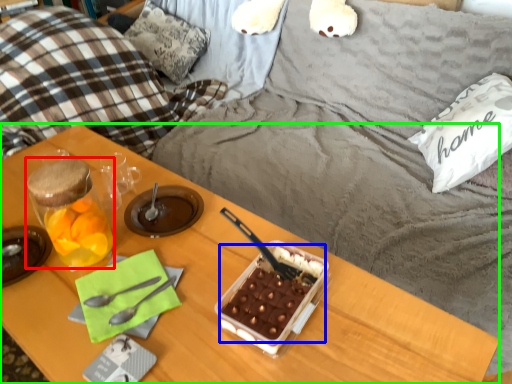
Question: Which object is positioned farthest from snack (highlighted by a red box)? Select from snack (highlighted by a blue box) and desk (highlighted by a green box).

Choices:
 (A) snack
 (B) desk

Answer: (A)